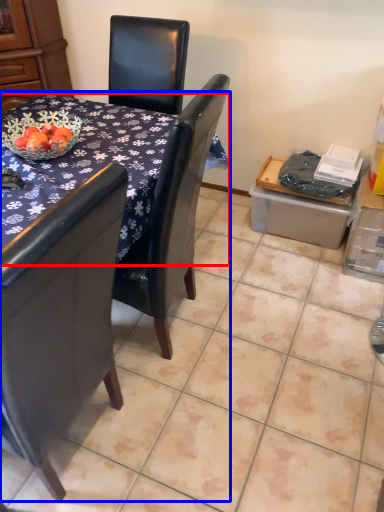
Question: Among these objects, which one is farthest to the camera, desk (highlighted by a red box) or table (highlighted by a blue box)?

Choices:
 (A) desk
 (B) table

Answer: (A)